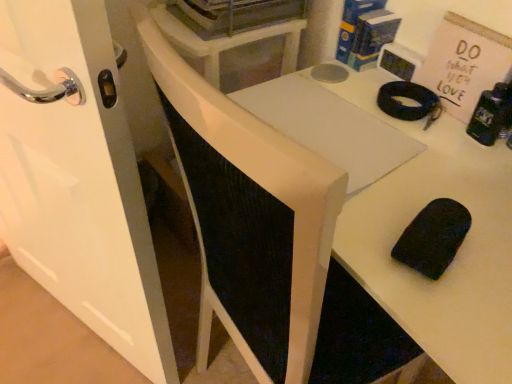
Question: From the image's perspective, is white matte table at center located above or below matte black clock at upper right, the 1th appliance from the bottom?

Choices:
 (A) below
 (B) above

Answer: (A)

Question: Is white matte table at center in front of or behind matte black clock at upper right, the 1th appliance from the bottom, in the image?

Choices:
 (A) front
 (B) behind

Answer: (A)

Question: Which object is positioned closest to the metallic gray dishwasher at upper center, the 2th appliance in the bottom-to-top sequence?

Choices:
 (A) matte black clock at upper right, which is the 2th appliance from left to right
 (B) white matte table at center
 (C) white glossy door at left

Answer: (A)

Question: Which of these objects is positioned farthest from the matte black clock at upper right, which is the 2th appliance from left to right?

Choices:
 (A) metallic gray dishwasher at upper center, the 2th appliance in the bottom-to-top sequence
 (B) white glossy door at left
 (C) white matte table at center

Answer: (B)